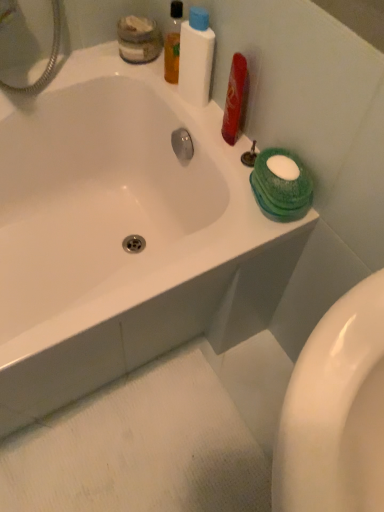
This screenshot has width=384, height=512. In order to click on vacant area situated to the left side of translucent plastic mouthwash at upper center in this screenshot , I will do `click(109, 62)`.